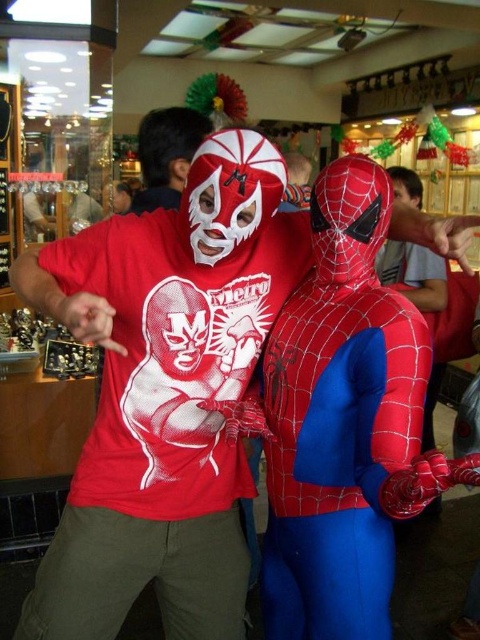
Based on the photo, can you confirm if white matte mask at center is smaller than matte plastic mask at center?

Yes, white matte mask at center is smaller than matte plastic mask at center.

Where is `white matte mask at center`? white matte mask at center is located at coordinates (222, 211).

Does point (247, 236) come farther from viewer compared to point (402, 188)?

No.

Locate an element on the screen. white matte mask at center is located at coordinates (222, 211).

Is point (155, 205) more distant than point (120, 204)?

That is False.

Between point (182, 116) and point (108, 184), which one is positioned behind?

Positioned behind is point (108, 184).

This screenshot has height=640, width=480. I want to click on matte white mask at upper center, so click(167, 154).

Between matte white mask at center and matte plastic mask at center, which one is positioned higher?

Positioned higher is matte white mask at center.

Is matte white mask at center smaller than matte plastic mask at center?

No, matte white mask at center is not smaller than matte plastic mask at center.

Where is `matte white mask at center`? The width and height of the screenshot is (480, 640). matte white mask at center is located at coordinates (117, 196).